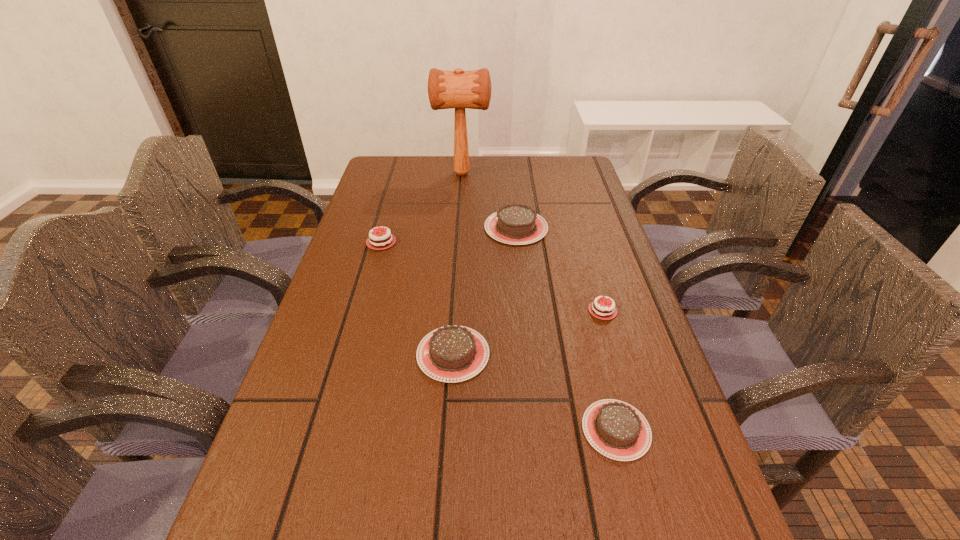
Identify which brown chocolate cake is the second nearest to the second nearest object. Please provide its 2D coordinates. Your answer should be formatted as a tuple, i.e. [(x, y)], where the tuple contains the x and y coordinates of a point satisfying the conditions above.

[(515, 224)]

Where is `red chocolate cake that is the second closest to the leftmost red chocolate cake`? red chocolate cake that is the second closest to the leftmost red chocolate cake is located at coordinates (455, 539).

Identify which red chocolate cake is the third closest to the fifth farthest chocolate cake. Please provide its 2D coordinates. Your answer should be formatted as a tuple, i.e. [(x, y)], where the tuple contains the x and y coordinates of a point satisfying the conditions above.

[(375, 245)]

I want to click on blank space that satisfies the following two spatial constraints: 1. on the strike surface of the tallest object; 2. on the right side of the second biggest red chocolate cake, so click(453, 310).

Identify the location of vacant space that satisfies the following two spatial constraints: 1. on the strike surface of the farthest object; 2. on the front side of the leftmost red chocolate cake. (458, 242).